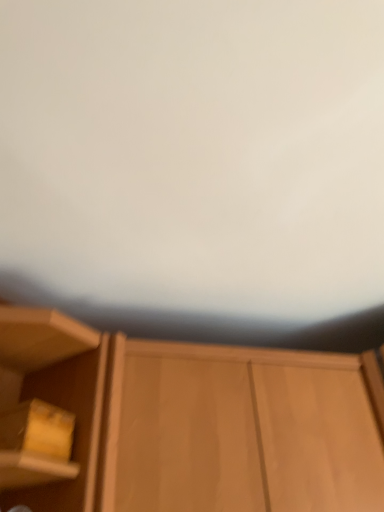
Image resolution: width=384 pixels, height=512 pixels. I want to click on white matte wall at upper center, so click(196, 168).

The image size is (384, 512). Describe the element at coordinates (196, 168) in the screenshot. I see `white matte wall at upper center` at that location.

The width and height of the screenshot is (384, 512). Find the location of `white matte wall at upper center`. white matte wall at upper center is located at coordinates (196, 168).